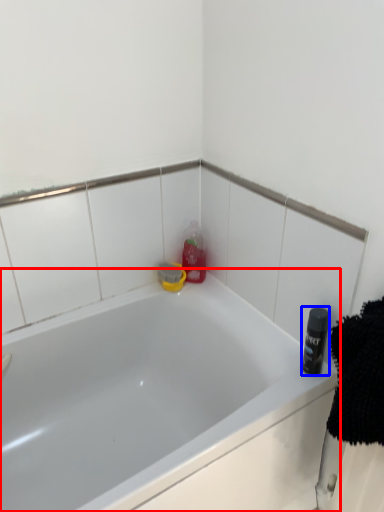
Question: Which object is further to the camera taking this photo, bathtub (highlighted by a red box) or toiletry (highlighted by a blue box)?

Choices:
 (A) bathtub
 (B) toiletry

Answer: (B)